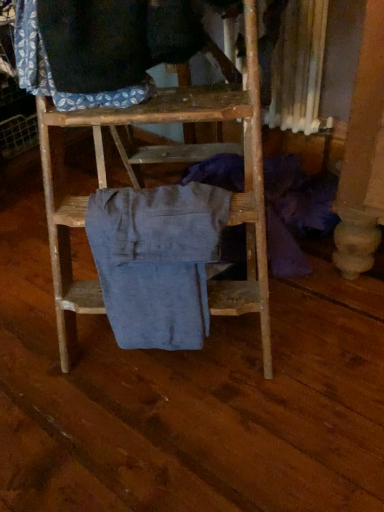
The image size is (384, 512). What do you see at coordinates (156, 261) in the screenshot? I see `denim pants at center, the first clothing positioned from the right` at bounding box center [156, 261].

You are a GUI agent. You are given a task and a screenshot of the screen. Output one action in this format:
    pyautogui.click(x=<x>, y=<y>)
    Task: Click on the denim pants at center, the 2th clothing when ordered from left to right
    
    Given the screenshot: What is the action you would take?
    pyautogui.click(x=156, y=261)

At what (x,y) coordinates should I click in order to perform the action: click on blue patterned fabric at upper left, the 2th clothing from the bottom. Please return your answer as a coordinate pair (x, y). This screenshot has width=384, height=512. Looking at the image, I should click on (101, 47).

What do you see at coordinates (101, 47) in the screenshot?
I see `blue patterned fabric at upper left, placed as the second clothing when sorted from right to left` at bounding box center [101, 47].

Find the location of a particular element. denim pants at center, placed as the 1th clothing when sorted from bottom to top is located at coordinates (156, 261).

Looking at this image, is denim pants at center, which is counted as the 2th clothing, starting from the top, to the left or to the right of blue patterned fabric at upper left, the first clothing when ordered from left to right, in the image?

denim pants at center, which is counted as the 2th clothing, starting from the top, is positioned on blue patterned fabric at upper left, the first clothing when ordered from left to right,'s right side.

Is denim pants at center, which is counted as the 2th clothing, starting from the top, in front of or behind blue patterned fabric at upper left, the first clothing when ordered from left to right, in the image?

Visually, denim pants at center, which is counted as the 2th clothing, starting from the top, is located behind blue patterned fabric at upper left, the first clothing when ordered from left to right.

Is point (124, 263) positioned behind point (106, 10)?

Yes, point (124, 263) is farther from viewer.

From the image's perspective, is denim pants at center, placed as the 1th clothing when sorted from bottom to top, on top of blue patterned fabric at upper left, placed as the second clothing when sorted from right to left?

No, from the image's perspective, denim pants at center, placed as the 1th clothing when sorted from bottom to top, is not above blue patterned fabric at upper left, placed as the second clothing when sorted from right to left.

From a real-world perspective, who is located higher, denim pants at center, the first clothing positioned from the right, or blue patterned fabric at upper left, which ranks as the first clothing in top-to-bottom order?

blue patterned fabric at upper left, which ranks as the first clothing in top-to-bottom order, is physically above.

In terms of width, does denim pants at center, the 2th clothing when ordered from left to right, look wider or thinner when compared to blue patterned fabric at upper left, placed as the second clothing when sorted from right to left?

In the image, denim pants at center, the 2th clothing when ordered from left to right, appears to be wider than blue patterned fabric at upper left, placed as the second clothing when sorted from right to left.

Is denim pants at center, the first clothing positioned from the right, shorter than blue patterned fabric at upper left, the first clothing when ordered from left to right?

In fact, denim pants at center, the first clothing positioned from the right, may be taller than blue patterned fabric at upper left, the first clothing when ordered from left to right.

Does denim pants at center, which is counted as the 2th clothing, starting from the top, have a smaller size compared to blue patterned fabric at upper left, placed as the second clothing when sorted from right to left?

No, denim pants at center, which is counted as the 2th clothing, starting from the top, is not smaller than blue patterned fabric at upper left, placed as the second clothing when sorted from right to left.

Is denim pants at center, the first clothing positioned from the right, located outside blue patterned fabric at upper left, the first clothing when ordered from left to right?

denim pants at center, the first clothing positioned from the right, lies outside blue patterned fabric at upper left, the first clothing when ordered from left to right,'s area.

Is denim pants at center, the first clothing positioned from the right, positioned far away from blue patterned fabric at upper left, which ranks as the first clothing in top-to-bottom order?

No, there isn't a large distance between denim pants at center, the first clothing positioned from the right, and blue patterned fabric at upper left, which ranks as the first clothing in top-to-bottom order.

Could you tell me if denim pants at center, which is counted as the 2th clothing, starting from the top, is turned towards blue patterned fabric at upper left, which ranks as the first clothing in top-to-bottom order?

No, denim pants at center, which is counted as the 2th clothing, starting from the top, is not turned towards blue patterned fabric at upper left, which ranks as the first clothing in top-to-bottom order.

Based on the photo, how many degrees apart are the facing directions of denim pants at center, placed as the 1th clothing when sorted from bottom to top, and blue patterned fabric at upper left, which ranks as the first clothing in top-to-bottom order?

The angular difference between denim pants at center, placed as the 1th clothing when sorted from bottom to top, and blue patterned fabric at upper left, which ranks as the first clothing in top-to-bottom order, is 65.7 degrees.

How far apart are denim pants at center, the first clothing positioned from the right, and blue patterned fabric at upper left, placed as the second clothing when sorted from right to left?

denim pants at center, the first clothing positioned from the right, and blue patterned fabric at upper left, placed as the second clothing when sorted from right to left, are 11.60 inches apart from each other.

This screenshot has width=384, height=512. Identify the location of clothing above the denim pants at center, placed as the 1th clothing when sorted from bottom to top (from a real-world perspective). (101, 47).

Does blue patterned fabric at upper left, the first clothing when ordered from left to right, appear on the left side of denim pants at center, the 2th clothing when ordered from left to right?

Yes.

Which is behind, blue patterned fabric at upper left, placed as the second clothing when sorted from right to left, or denim pants at center, the 2th clothing when ordered from left to right?

denim pants at center, the 2th clothing when ordered from left to right.

Is point (155, 14) farther from viewer compared to point (191, 338)?

No.

From the image's perspective, is blue patterned fabric at upper left, which ranks as the first clothing in top-to-bottom order, located above or below denim pants at center, the 2th clothing when ordered from left to right?

blue patterned fabric at upper left, which ranks as the first clothing in top-to-bottom order, is situated higher than denim pants at center, the 2th clothing when ordered from left to right, in the image.

From a real-world perspective, relative to denim pants at center, placed as the 1th clothing when sorted from bottom to top, is blue patterned fabric at upper left, placed as the second clothing when sorted from right to left, vertically above or below?

From a real-world perspective, blue patterned fabric at upper left, placed as the second clothing when sorted from right to left, is physically above denim pants at center, placed as the 1th clothing when sorted from bottom to top.

Based on the photo, which object is thinner, blue patterned fabric at upper left, which ranks as the first clothing in top-to-bottom order, or denim pants at center, the 2th clothing when ordered from left to right?

blue patterned fabric at upper left, which ranks as the first clothing in top-to-bottom order, is thinner.

Does blue patterned fabric at upper left, the first clothing when ordered from left to right, have a greater height compared to denim pants at center, which is counted as the 2th clothing, starting from the top?

Incorrect, the height of blue patterned fabric at upper left, the first clothing when ordered from left to right, is not larger of that of denim pants at center, which is counted as the 2th clothing, starting from the top.

Is blue patterned fabric at upper left, placed as the second clothing when sorted from right to left, smaller than denim pants at center, which is counted as the 2th clothing, starting from the top?

Yes, blue patterned fabric at upper left, placed as the second clothing when sorted from right to left, is smaller than denim pants at center, which is counted as the 2th clothing, starting from the top.

Is blue patterned fabric at upper left, the 2th clothing from the bottom, located outside denim pants at center, placed as the 1th clothing when sorted from bottom to top?

Yes, blue patterned fabric at upper left, the 2th clothing from the bottom, is located beyond the bounds of denim pants at center, placed as the 1th clothing when sorted from bottom to top.

Are blue patterned fabric at upper left, the first clothing when ordered from left to right, and denim pants at center, placed as the 1th clothing when sorted from bottom to top, far apart?

No, blue patterned fabric at upper left, the first clothing when ordered from left to right, is in close proximity to denim pants at center, placed as the 1th clothing when sorted from bottom to top.

Based on the photo, is blue patterned fabric at upper left, which ranks as the first clothing in top-to-bottom order, positioned with its back to denim pants at center, the first clothing positioned from the right?

blue patterned fabric at upper left, which ranks as the first clothing in top-to-bottom order, is not turned away from denim pants at center, the first clothing positioned from the right.

What's the angular difference between blue patterned fabric at upper left, the first clothing when ordered from left to right, and denim pants at center, the first clothing positioned from the right,'s facing directions?

65.7 degrees separate the facing orientations of blue patterned fabric at upper left, the first clothing when ordered from left to right, and denim pants at center, the first clothing positioned from the right.

The image size is (384, 512). What are the coordinates of `clothing above the denim pants at center, the first clothing positioned from the right (from a real-world perspective)` in the screenshot? It's located at (101, 47).

Locate an element on the screen. The image size is (384, 512). clothing positioned vertically above the denim pants at center, the 2th clothing when ordered from left to right (from a real-world perspective) is located at coordinates (101, 47).

Locate an element on the screen. This screenshot has height=512, width=384. clothing lying on the right of blue patterned fabric at upper left, placed as the second clothing when sorted from right to left is located at coordinates (156, 261).